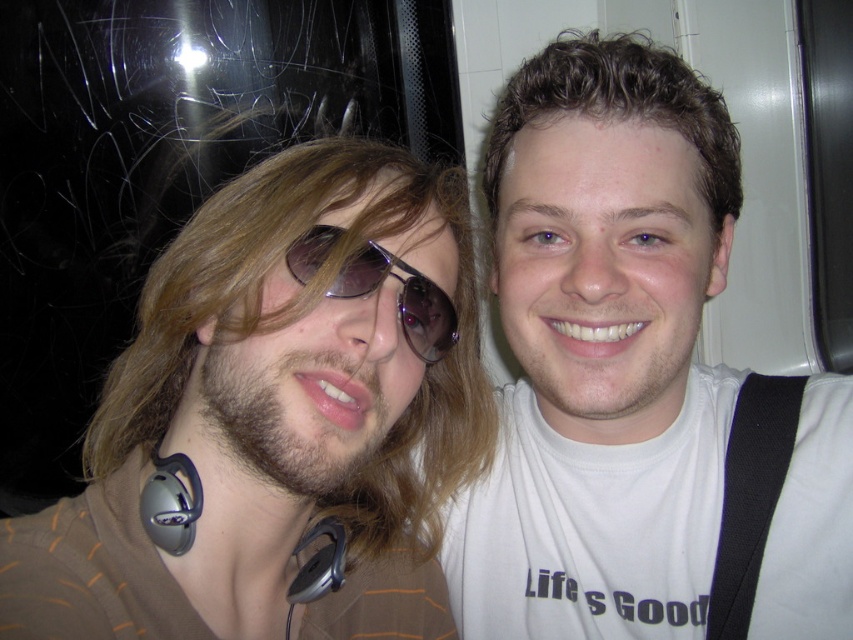
Question: Can you confirm if brown matte hair at left is wider than sunglasses at center?

Choices:
 (A) no
 (B) yes

Answer: (B)

Question: Which point is closer to the camera?

Choices:
 (A) (579, 445)
 (B) (318, 563)

Answer: (B)

Question: Does white matte t-shirt at center come in front of satin silver earphone at lower left?

Choices:
 (A) no
 (B) yes

Answer: (A)

Question: Does sunglasses at center have a greater width compared to gray matte earphone at lower left?

Choices:
 (A) yes
 (B) no

Answer: (A)

Question: Estimate the real-world distances between objects in this image. Which object is closer to the gray matte earphone at lower left?

Choices:
 (A) brown matte hair at left
 (B) satin silver earphone at lower left
 (C) sunglasses at center

Answer: (B)

Question: Which of the following is the farthest from the observer?

Choices:
 (A) gray matte earphone at lower left
 (B) sunglasses at center

Answer: (A)